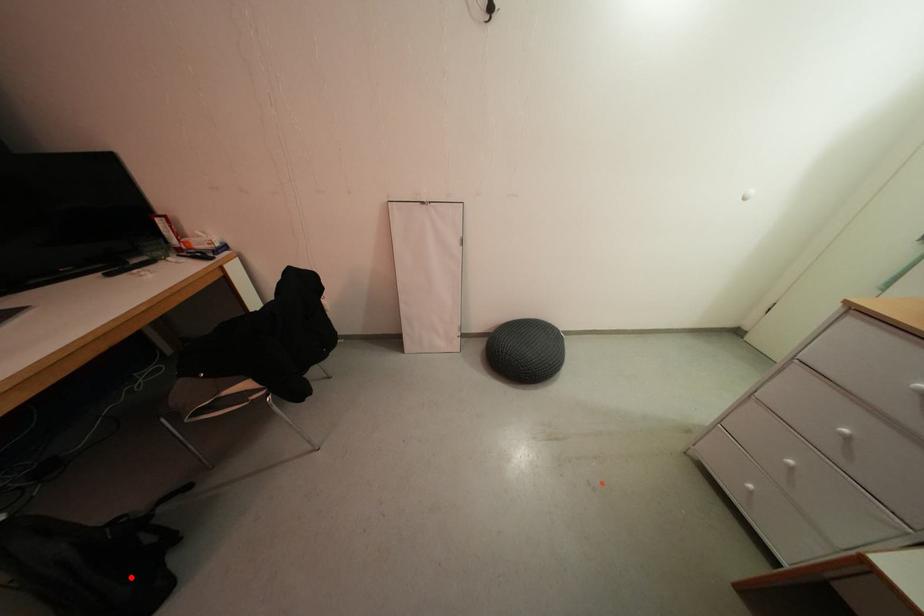
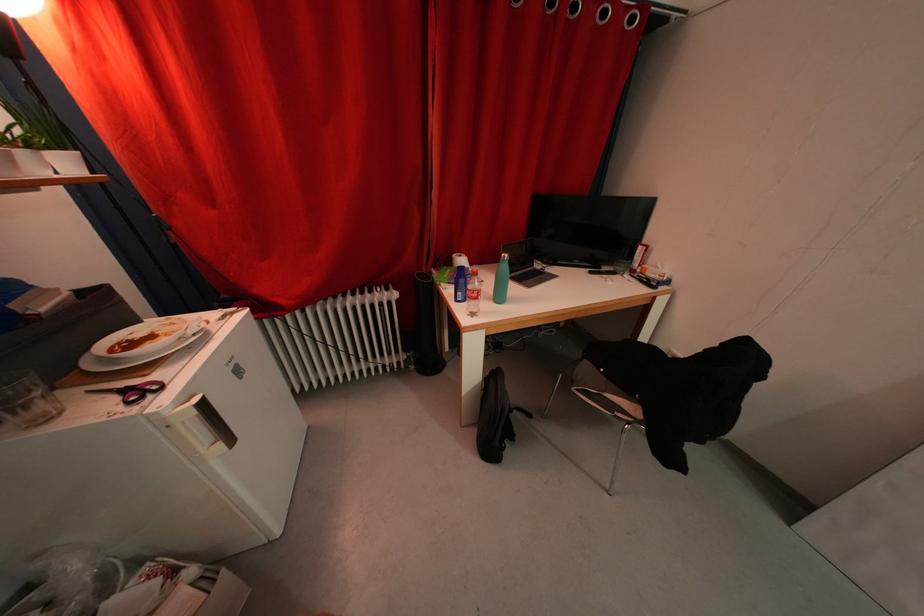
Question: I am providing you with two images of the same scene from different viewpoints. Given a red point in image1, look at the same physical point in image2. Is it:

Choices:
 (A) Closer to the viewpoint
 (B) Farther from the viewpoint

Answer: (B)